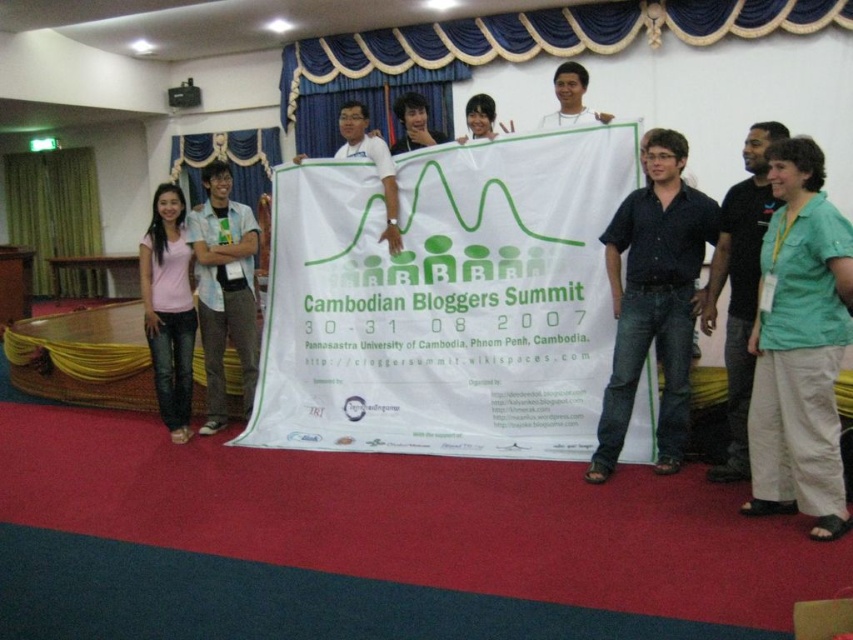
The height and width of the screenshot is (640, 853). Find the location of `pink cotton shirt at left`. pink cotton shirt at left is located at coordinates (167, 308).

Who is lower down, pink cotton shirt at left or matte white shirt at center?

pink cotton shirt at left is below.

Is point (172, 342) more distant than point (566, 124)?

Yes, it is behind point (566, 124).

This screenshot has width=853, height=640. Find the location of `pink cotton shirt at left`. pink cotton shirt at left is located at coordinates (167, 308).

Is dark blue shirt at center shorter than green shirt at right?

No, dark blue shirt at center is not shorter than green shirt at right.

Does point (666, 364) come closer to viewer compared to point (751, 161)?

No, (666, 364) is further to viewer.

Image resolution: width=853 pixels, height=640 pixels. I want to click on dark blue shirt at center, so click(653, 300).

Which is more to the left, matte gray pants at left or white matte shirt at center?

matte gray pants at left is more to the left.

Which is in front, point (207, 282) or point (340, 116)?

Positioned in front is point (207, 282).

Locate an element on the screen. matte gray pants at left is located at coordinates tap(224, 289).